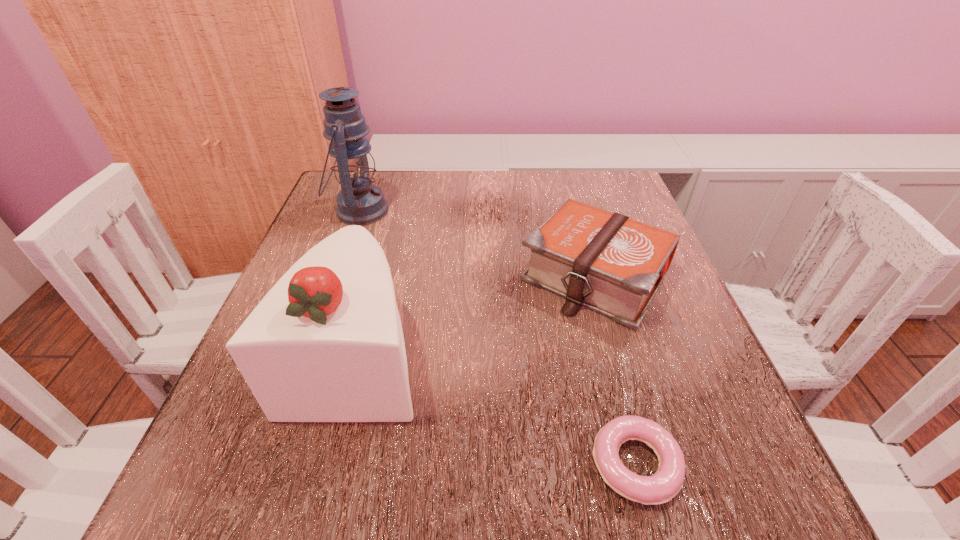
Where is `object located in the near edge section of the desktop`? Image resolution: width=960 pixels, height=540 pixels. object located in the near edge section of the desktop is located at coordinates (661, 487).

Find the location of `lantern that is at the left edge`. lantern that is at the left edge is located at coordinates coord(359,202).

Where is `cake situated at the left edge`? The width and height of the screenshot is (960, 540). cake situated at the left edge is located at coordinates (325, 344).

The image size is (960, 540). Identify the location of Bible at the right edge. (607, 262).

The height and width of the screenshot is (540, 960). What are the coordinates of `doughnut at the right edge` in the screenshot? It's located at (661, 487).

Locate an element on the screen. This screenshot has height=540, width=960. object situated at the far left corner is located at coordinates (359, 202).

Find the location of a particular element. Image resolution: width=960 pixels, height=540 pixels. object that is positioned at the near right corner is located at coordinates (661, 487).

This screenshot has height=540, width=960. What are the coordinates of `free region at the far edge of the desktop` in the screenshot? It's located at (538, 177).

In order to click on vacant space at the right edge of the desktop in this screenshot , I will do `click(662, 399)`.

Where is `vacant region at the far right corner of the desktop`? The width and height of the screenshot is (960, 540). vacant region at the far right corner of the desktop is located at coordinates (589, 171).